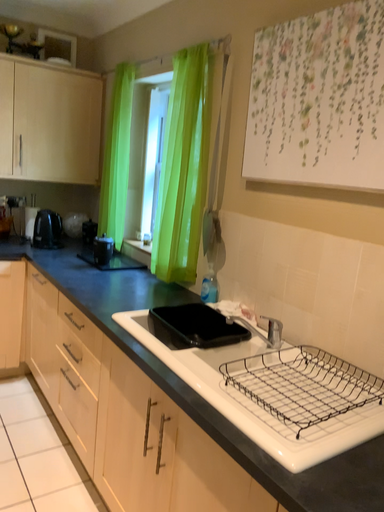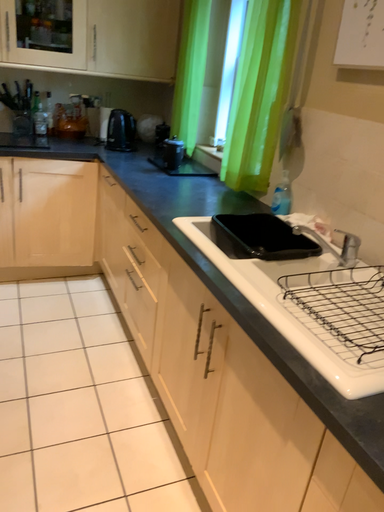
Question: How did the camera likely rotate when shooting the video?

Choices:
 (A) rotated downward
 (B) rotated upward

Answer: (A)